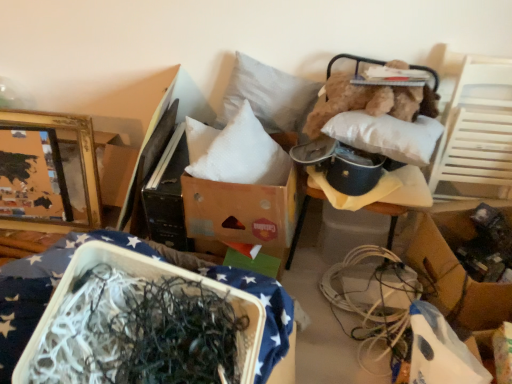
Question: Which direction should I rotate to look at white soft pillow at center, the 1th pillow when ordered from right to left?

Choices:
 (A) left
 (B) right

Answer: (B)

Question: Considering the relative sizes of brown cardboard box at lower right, which ranks as the second cardboard box in top-to-bottom order, and white fabric cushion at upper right, the second furniture viewed from the left, in the image provided, is brown cardboard box at lower right, which ranks as the second cardboard box in top-to-bottom order, shorter than white fabric cushion at upper right, the second furniture viewed from the left,?

Choices:
 (A) yes
 (B) no

Answer: (A)

Question: Considering the relative sizes of brown cardboard box at lower right, arranged as the first cardboard box when ordered from the bottom, and white fabric cushion at upper right, which ranks as the first furniture in right-to-left order, in the image provided, is brown cardboard box at lower right, arranged as the first cardboard box when ordered from the bottom, thinner than white fabric cushion at upper right, which ranks as the first furniture in right-to-left order,?

Choices:
 (A) yes
 (B) no

Answer: (A)

Question: From a real-world perspective, does brown cardboard box at lower right, arranged as the first cardboard box when ordered from the bottom, stand above white fabric cushion at upper right, the second furniture viewed from the left?

Choices:
 (A) yes
 (B) no

Answer: (B)

Question: Is brown cardboard box at lower right, which ranks as the second cardboard box in top-to-bottom order, facing towards white fabric cushion at upper right, the second furniture viewed from the left?

Choices:
 (A) yes
 (B) no

Answer: (B)

Question: Does brown cardboard box at lower right, acting as the 2th cardboard box starting from the left, have a greater width compared to white fabric cushion at upper right, acting as the 1th furniture starting from the back?

Choices:
 (A) no
 (B) yes

Answer: (A)

Question: Does brown cardboard box at lower right, positioned as the 1th cardboard box in right-to-left order, have a greater height compared to white fabric cushion at upper right, which ranks as the first furniture in right-to-left order?

Choices:
 (A) no
 (B) yes

Answer: (A)

Question: Considering the relative sizes of white soft pillow at center, which ranks as the 2th pillow in left-to-right order, and brown cardboard box at lower right, which ranks as the second cardboard box in top-to-bottom order, in the image provided, is white soft pillow at center, which ranks as the 2th pillow in left-to-right order, thinner than brown cardboard box at lower right, which ranks as the second cardboard box in top-to-bottom order,?

Choices:
 (A) no
 (B) yes

Answer: (A)

Question: Considering the relative sizes of white soft pillow at center, which ranks as the 2th pillow in left-to-right order, and brown cardboard box at lower right, arranged as the first cardboard box when ordered from the bottom, in the image provided, is white soft pillow at center, which ranks as the 2th pillow in left-to-right order, wider than brown cardboard box at lower right, arranged as the first cardboard box when ordered from the bottom,?

Choices:
 (A) yes
 (B) no

Answer: (A)

Question: From a real-world perspective, is white soft pillow at center, the 1th pillow when ordered from right to left, below brown cardboard box at lower right, positioned as the 1th cardboard box in right-to-left order?

Choices:
 (A) yes
 (B) no

Answer: (B)

Question: Is white soft pillow at center, which ranks as the 2th pillow in left-to-right order, at the right side of brown cardboard box at lower right, acting as the 2th cardboard box starting from the left?

Choices:
 (A) yes
 (B) no

Answer: (B)

Question: Is white soft pillow at center, the 1th pillow when ordered from right to left, not close to brown cardboard box at lower right, arranged as the first cardboard box when ordered from the bottom?

Choices:
 (A) yes
 (B) no

Answer: (B)

Question: Is white soft pillow at center, the 1th pillow when ordered from right to left, facing away from brown cardboard box at lower right, arranged as the first cardboard box when ordered from the bottom?

Choices:
 (A) no
 (B) yes

Answer: (A)

Question: Considering the relative positions of white plastic wire at lower right and brown cardboard box at lower right, which ranks as the second cardboard box in top-to-bottom order, in the image provided, is white plastic wire at lower right to the right of brown cardboard box at lower right, which ranks as the second cardboard box in top-to-bottom order, from the viewer's perspective?

Choices:
 (A) no
 (B) yes

Answer: (A)